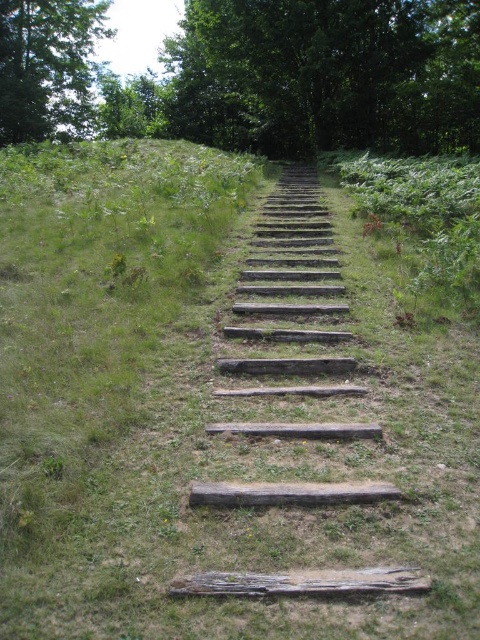
Between green leafy tree at upper center and green leafy tree at upper left, which one appears on the left side from the viewer's perspective?

green leafy tree at upper left is more to the left.

Does green leafy tree at upper center appear under green leafy tree at upper left?

Incorrect, green leafy tree at upper center is not positioned below green leafy tree at upper left.

What do you see at coordinates (325, 74) in the screenshot? I see `green leafy tree at upper center` at bounding box center [325, 74].

Identify the location of green leafy tree at upper center. This screenshot has height=640, width=480. (325, 74).

Can you confirm if green leafy tree at upper center is wider than weathered wood stairs at center?

Yes, green leafy tree at upper center is wider than weathered wood stairs at center.

Between green leafy tree at upper center and weathered wood stairs at center, which one is positioned higher?

green leafy tree at upper center

The image size is (480, 640). Describe the element at coordinates (325, 74) in the screenshot. I see `green leafy tree at upper center` at that location.

Image resolution: width=480 pixels, height=640 pixels. In order to click on green leafy tree at upper center in this screenshot , I will do `click(325, 74)`.

Who is positioned more to the right, weathered wood stairs at center or green leafy tree at upper left?

Positioned to the right is weathered wood stairs at center.

Is weathered wood stairs at center positioned before green leafy tree at upper left?

Yes, weathered wood stairs at center is closer to the viewer.

Who is more forward, (x=289, y=428) or (x=88, y=36)?

Point (x=289, y=428) is in front.

The height and width of the screenshot is (640, 480). Find the location of `weathered wood stairs at center`. weathered wood stairs at center is located at coordinates (290, 298).